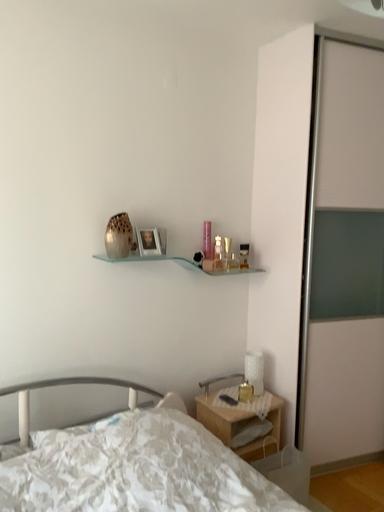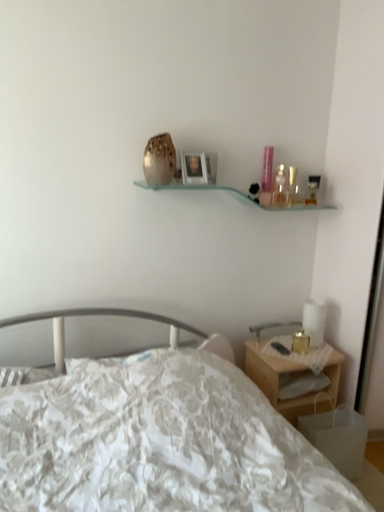
Question: How did the camera likely rotate when shooting the video?

Choices:
 (A) rotated downward
 (B) rotated upward

Answer: (A)